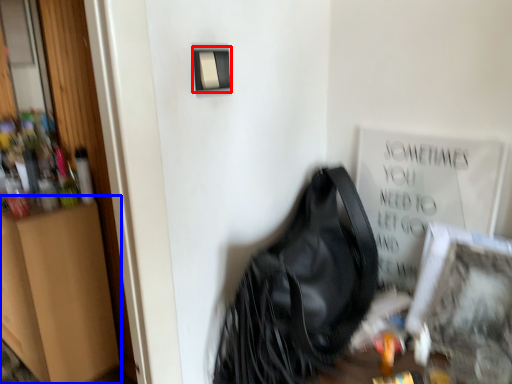
Question: Which point is further to the camera, light switch (highlighted by a red box) or dresser (highlighted by a blue box)?

Choices:
 (A) light switch
 (B) dresser

Answer: (B)